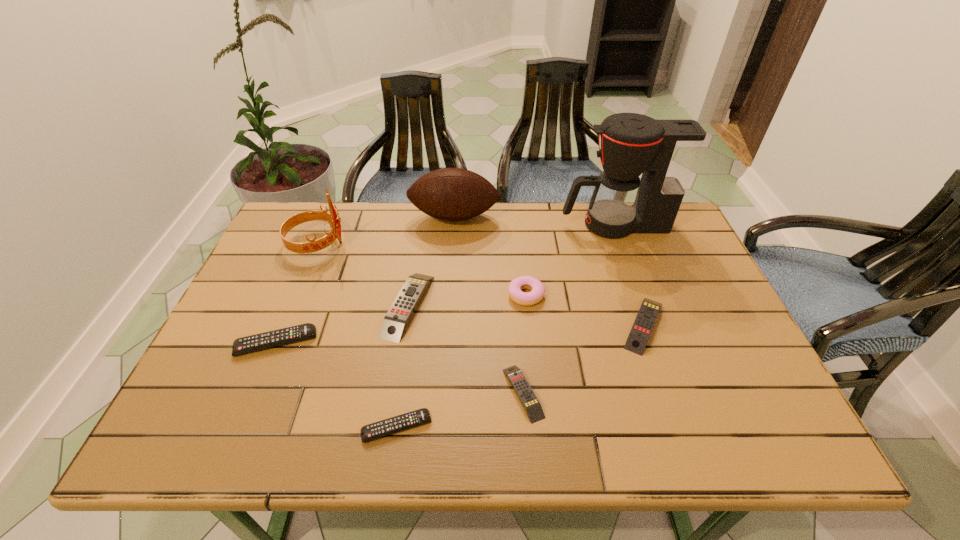
Where is `object that stands as the fifth closest to the tiara`? object that stands as the fifth closest to the tiara is located at coordinates (372, 431).

Locate an element on the screen. The height and width of the screenshot is (540, 960). remote control that is the closest to the nearer black remote control is located at coordinates (527, 397).

Locate an element on the screen. remote control object that ranks as the fourth closest to the leftmost yellow remote control is located at coordinates (640, 332).

This screenshot has width=960, height=540. In order to click on the closest yellow remote control to the smallest yellow remote control in this screenshot , I will do `click(395, 321)`.

Where is `yellow remote control that is the second closest one to the shortest remote control`? Image resolution: width=960 pixels, height=540 pixels. yellow remote control that is the second closest one to the shortest remote control is located at coordinates (395, 321).

Where is `vacant region that satisfies the following two spatial constraints: 1. on the front-facing side of the red tiara; 2. on the front side of the bigger black remote control`? The width and height of the screenshot is (960, 540). vacant region that satisfies the following two spatial constraints: 1. on the front-facing side of the red tiara; 2. on the front side of the bigger black remote control is located at coordinates (276, 342).

Find the location of `free spot that satisfies the following two spatial constraints: 1. on the back side of the smallest yellow remote control; 2. on the left side of the pink doughnut`. free spot that satisfies the following two spatial constraints: 1. on the back side of the smallest yellow remote control; 2. on the left side of the pink doughnut is located at coordinates (516, 295).

The image size is (960, 540). In order to click on free space that satisfies the following two spatial constraints: 1. on the laces of the brown football; 2. on the front-facing side of the red tiara in this screenshot , I will do `click(452, 244)`.